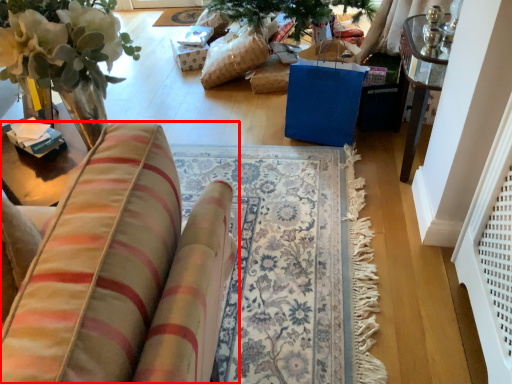
Question: From the image's perspective, considering the relative positions of furniture (annotated by the red box) and mat in the image provided, where is furniture (annotated by the red box) located with respect to the staircase?

Choices:
 (A) above
 (B) below

Answer: (B)